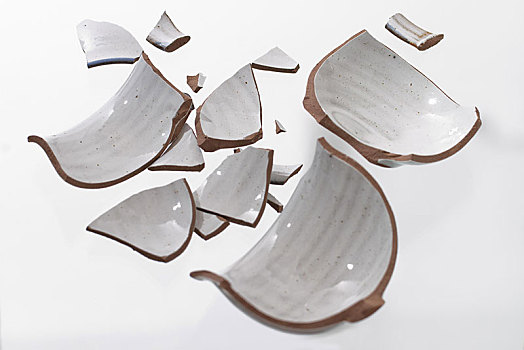
You are a GUI agent. You are given a task and a screenshot of the screen. Output one action in this format:
    pyautogui.click(x=<x>, y=<y>)
    Task: Click on the farest left piece of broken dish
    
    Given the screenshot: What is the action you would take?
    pyautogui.click(x=29, y=140)